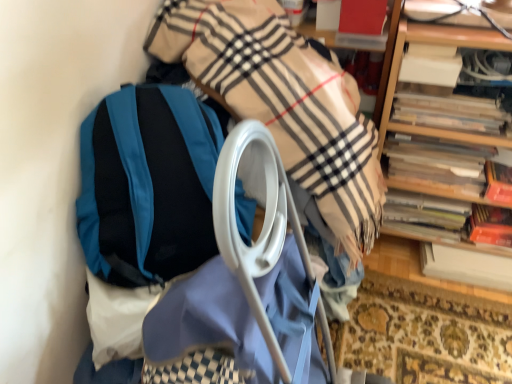
You are a GUI agent. You are given a task and a screenshot of the screen. Output one action in this format:
    pyautogui.click(x=<x>, y=<y>)
    Task: Click on the wooden bookshelf at upper right
    
    Given the screenshot: What is the action you would take?
    pyautogui.click(x=438, y=44)

Find the location of a particular element. This screenshot has height=384, width=512. wooden book at right, the third book in the bottom-to-top sequence is located at coordinates (440, 167).

Image resolution: width=512 pixels, height=384 pixels. What are the coordinates of `hardcover book at right, the second book positioned from the bottom` in the screenshot? It's located at (426, 216).

The width and height of the screenshot is (512, 384). Describe the element at coordinates (431, 65) in the screenshot. I see `white paper at upper right, the first book from the top` at that location.

Identify the location of white paper at right, which is counted as the 5th book, starting from the top. The image size is (512, 384). (466, 266).

Image resolution: width=512 pixels, height=384 pixels. I want to click on teal fabric backpack at left, so click(148, 185).

At what (x,y) coordinates should I click in order to perform the action: click on backpack above the white paper at right, which is counted as the 5th book, starting from the top (from the image's perspective). Please return your answer as a coordinate pair (x, y). Looking at the image, I should click on click(x=148, y=185).

Which of these two, teal fabric backpack at left or white paper at right, which is counted as the 1th book, starting from the bottom, is thinner?

With smaller width is white paper at right, which is counted as the 1th book, starting from the bottom.

Considering the positions of point (99, 188) and point (454, 265), is point (99, 188) closer or farther from the camera than point (454, 265)?

Point (99, 188) appears to be closer to the viewer than point (454, 265).

From the picture: Is teal fabric backpack at left facing away from white paper at right, which is counted as the 5th book, starting from the top?

teal fabric backpack at left is not turned away from white paper at right, which is counted as the 5th book, starting from the top.

Are hardcover book at right, which is the 4th book from top to bottom, and white paper at right, which is counted as the 1th book, starting from the bottom, located far from each other?

No, hardcover book at right, which is the 4th book from top to bottom, is not far from white paper at right, which is counted as the 1th book, starting from the bottom.

From the image's perspective, is hardcover book at right, the second book positioned from the bottom, located above white paper at right, which is counted as the 5th book, starting from the top?

Yes, from the image's perspective, hardcover book at right, the second book positioned from the bottom, is above white paper at right, which is counted as the 5th book, starting from the top.

Between hardcover book at right, the second book positioned from the bottom, and white paper at right, which is counted as the 1th book, starting from the bottom, which one is positioned behind?

hardcover book at right, the second book positioned from the bottom, is further away from the camera.

Identify the location of book that is the 1st object located above the white paper at right, which is counted as the 5th book, starting from the top (from the image's perspective). Image resolution: width=512 pixels, height=384 pixels. (426, 216).

The width and height of the screenshot is (512, 384). I want to click on backpack below the white paper at upper right, the first book from the top (from the image's perspective), so click(x=148, y=185).

Does teal fabric backpack at left contain white paper at upper right, the first book from the top?

Actually, white paper at upper right, the first book from the top, is outside teal fabric backpack at left.

Which object is positioned more to the left, teal fabric backpack at left or white paper at upper right, the first book from the top?

Positioned to the left is teal fabric backpack at left.

Between teal fabric backpack at left and white paper at upper right, the first book from the top, which one has larger size?

teal fabric backpack at left is bigger.

How different are the orientations of wooden spines at right, which ranks as the fourth book in bottom-to-top order, and wooden book at right, marked as the 3th book in a top-to-bottom arrangement, in degrees?

wooden spines at right, which ranks as the fourth book in bottom-to-top order, and wooden book at right, marked as the 3th book in a top-to-bottom arrangement, are facing 0.00876 degrees away from each other.

Is wooden spines at right, the second book from the top, positioned with its back to wooden book at right, the third book in the bottom-to-top sequence?

No, wooden book at right, the third book in the bottom-to-top sequence, is not at the back of wooden spines at right, the second book from the top.

Is wooden spines at right, which ranks as the fourth book in bottom-to-top order, outside of wooden book at right, marked as the 3th book in a top-to-bottom arrangement?

wooden spines at right, which ranks as the fourth book in bottom-to-top order, lies outside wooden book at right, marked as the 3th book in a top-to-bottom arrangement,'s area.

Which is farther from the camera, (x=433, y=87) or (x=419, y=157)?

The point (x=419, y=157) is behind.

Which object is more forward, wooden book at right, the third book in the bottom-to-top sequence, or teal fabric backpack at left?

teal fabric backpack at left is closer to the camera.

From the image's perspective, relative to teal fabric backpack at left, is wooden book at right, the third book in the bottom-to-top sequence, above or below?

Based on their image positions, wooden book at right, the third book in the bottom-to-top sequence, is located above teal fabric backpack at left.

How far apart are wooden book at right, the third book in the bottom-to-top sequence, and teal fabric backpack at left?

wooden book at right, the third book in the bottom-to-top sequence, and teal fabric backpack at left are 78.11 centimeters apart from each other.

From a real-world perspective, is wooden book at right, marked as the 3th book in a top-to-bottom arrangement, below teal fabric backpack at left?

Correct, in the physical world, wooden book at right, marked as the 3th book in a top-to-bottom arrangement, is lower than teal fabric backpack at left.

Considering the positions of objects white paper at right, which is counted as the 5th book, starting from the top, and white paper at upper right, the fifth book positioned from the bottom, in the image provided, who is more to the left, white paper at right, which is counted as the 5th book, starting from the top, or white paper at upper right, the fifth book positioned from the bottom,?

From the viewer's perspective, white paper at upper right, the fifth book positioned from the bottom, appears more on the left side.

Starting from the white paper at right, which is counted as the 5th book, starting from the top, which book is the 3rd one in front? Please provide its 2D coordinates.

[(431, 65)]

From a real-world perspective, between white paper at right, which is counted as the 1th book, starting from the bottom, and white paper at upper right, the fifth book positioned from the bottom, who is vertically lower?

In real-world perspective, white paper at right, which is counted as the 1th book, starting from the bottom, is lower.

Is white paper at right, which is counted as the 1th book, starting from the bottom, in front of white paper at upper right, the fifth book positioned from the bottom?

No, it is not.

The height and width of the screenshot is (384, 512). I want to click on the 1st book in front of the hardcover book at right, which is the 4th book from top to bottom, starting your count from the anchor, so click(x=466, y=266).

From the image's perspective, is white paper at right, which is counted as the 1th book, starting from the bottom, positioned above or below hardcover book at right, which is the 4th book from top to bottom?

From the image's perspective, white paper at right, which is counted as the 1th book, starting from the bottom, appears below hardcover book at right, which is the 4th book from top to bottom.

From a real-world perspective, count 4th books downward from the teal fabric backpack at left and point to it. Please provide its 2D coordinates.

[(466, 266)]

Identify the location of book lying behind the white paper at right, which is counted as the 1th book, starting from the bottom. (426, 216).

Estimate the real-world distances between objects in this image. Which object is further from wooden book at right, the third book in the bottom-to-top sequence, hardcover book at right, the second book positioned from the bottom, or white paper at upper right, the fifth book positioned from the bottom?

white paper at upper right, the fifth book positioned from the bottom, lies further to wooden book at right, the third book in the bottom-to-top sequence, than the other object.

Based on the photo, when comparing their distances from wooden book at right, the third book in the bottom-to-top sequence, does white paper at upper right, the fifth book positioned from the bottom, or hardcover book at right, which is the 4th book from top to bottom, seem further?

The object further to wooden book at right, the third book in the bottom-to-top sequence, is white paper at upper right, the fifth book positioned from the bottom.

Looking at the image, which one is located closer to white paper at right, which is counted as the 5th book, starting from the top, teal fabric backpack at left or wooden bookshelf at upper right?

The object closer to white paper at right, which is counted as the 5th book, starting from the top, is wooden bookshelf at upper right.

Considering their positions, is wooden book at right, marked as the 3th book in a top-to-bottom arrangement, positioned further to wooden spines at right, the second book from the top, than white paper at upper right, the fifth book positioned from the bottom?

wooden book at right, marked as the 3th book in a top-to-bottom arrangement.

Which object lies further to the anchor point wooden spines at right, the second book from the top, teal fabric backpack at left or hardcover book at right, the second book positioned from the bottom?

teal fabric backpack at left lies further to wooden spines at right, the second book from the top, than the other object.

Which object lies nearer to the anchor point white paper at right, which is counted as the 1th book, starting from the bottom, wooden bookshelf at upper right or hardcover book at right, the second book positioned from the bottom?

Among the two, hardcover book at right, the second book positioned from the bottom, is located nearer to white paper at right, which is counted as the 1th book, starting from the bottom.

When comparing their distances from white paper at right, which is counted as the 5th book, starting from the top, does wooden book at right, marked as the 3th book in a top-to-bottom arrangement, or hardcover book at right, which is the 4th book from top to bottom, seem further?

Among the two, wooden book at right, marked as the 3th book in a top-to-bottom arrangement, is located further to white paper at right, which is counted as the 5th book, starting from the top.

Considering their positions, is wooden spines at right, the second book from the top, positioned further to wooden bookshelf at upper right than teal fabric backpack at left?

teal fabric backpack at left is further to wooden bookshelf at upper right.

Image resolution: width=512 pixels, height=384 pixels. In order to click on book between wooden spines at right, which ranks as the fourth book in bottom-to-top order, and hardcover book at right, which is the 4th book from top to bottom, in the vertical direction in this screenshot , I will do `click(440, 167)`.

The image size is (512, 384). What are the coordinates of `shelf that lies between white paper at upper right, the first book from the top, and wooden book at right, marked as the 3th book in a top-to-bottom arrangement, from top to bottom` in the screenshot? It's located at (438, 44).

The height and width of the screenshot is (384, 512). I want to click on book between white paper at upper right, the first book from the top, and wooden book at right, the third book in the bottom-to-top sequence, vertically, so click(x=450, y=110).

Locate an element on the screen. The width and height of the screenshot is (512, 384). shelf between wooden spines at right, the second book from the top, and white paper at right, which is counted as the 1th book, starting from the bottom, in the up-down direction is located at coordinates (438, 44).